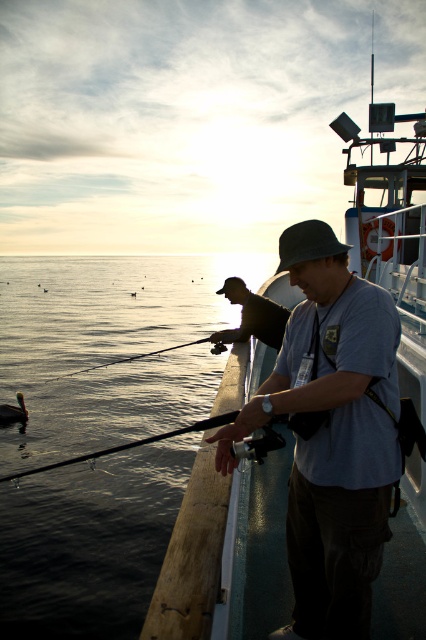
You are standing on the boat deck and want to cast your fishing line into the dark blue water at lower left. Based on the coordinates provided, where exactly should you aim your cast?

You should aim your cast at the coordinates point (109, 348) where the dark blue water at lower left is located.

You are standing on the deck of the boat and want to place a small item between the gray fabric shirt at center and the black matte fishing pole at center. Which object should you place it closer to if you want the item to be more visible from above? Explain your reasoning.

You should place the item closer to the gray fabric shirt at center because it has a greater height compared to the black matte fishing pole at center, making it more visible from above.